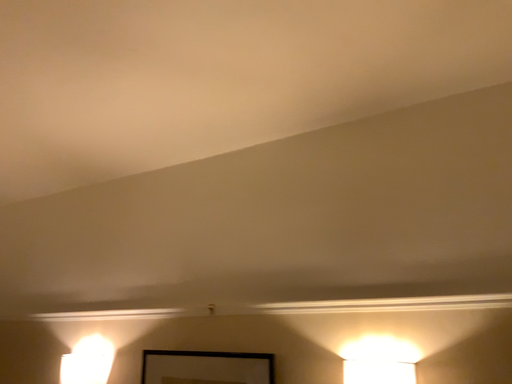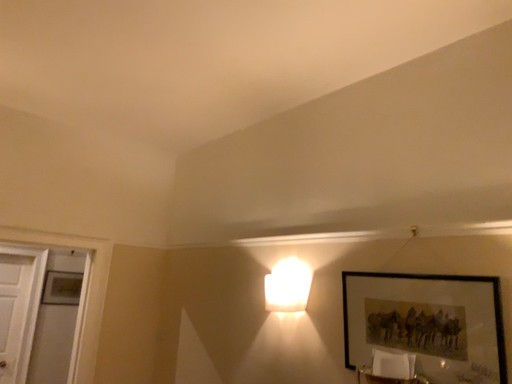
Question: How did the camera likely rotate when shooting the video?

Choices:
 (A) rotated left
 (B) rotated right

Answer: (A)